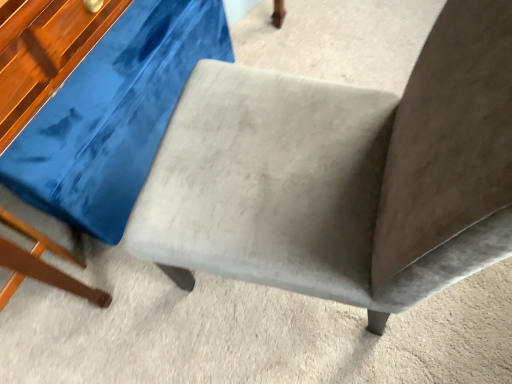
Question: Is suede gray swivel chair at center to the left of suede-like gray chair at center from the viewer's perspective?

Choices:
 (A) yes
 (B) no

Answer: (A)

Question: Is there a large distance between suede gray swivel chair at center and suede-like gray chair at center?

Choices:
 (A) yes
 (B) no

Answer: (B)

Question: From a real-world perspective, is suede gray swivel chair at center below suede-like gray chair at center?

Choices:
 (A) no
 (B) yes

Answer: (B)

Question: Does suede gray swivel chair at center have a larger size compared to suede-like gray chair at center?

Choices:
 (A) yes
 (B) no

Answer: (B)

Question: From the image's perspective, is suede gray swivel chair at center located beneath suede-like gray chair at center?

Choices:
 (A) no
 (B) yes

Answer: (A)

Question: Can you confirm if suede gray swivel chair at center is thinner than suede-like gray chair at center?

Choices:
 (A) yes
 (B) no

Answer: (B)

Question: Would you say suede-like gray chair at center contains suede gray swivel chair at center?

Choices:
 (A) no
 (B) yes

Answer: (A)

Question: From a real-world perspective, is suede-like gray chair at center located beneath suede gray swivel chair at center?

Choices:
 (A) yes
 (B) no

Answer: (B)

Question: Can you see suede-like gray chair at center touching suede gray swivel chair at center?

Choices:
 (A) yes
 (B) no

Answer: (B)

Question: Is suede-like gray chair at center positioned behind suede gray swivel chair at center?

Choices:
 (A) no
 (B) yes

Answer: (A)

Question: Considering the relative positions of suede-like gray chair at center and suede gray swivel chair at center in the image provided, is suede-like gray chair at center to the right of suede gray swivel chair at center from the viewer's perspective?

Choices:
 (A) yes
 (B) no

Answer: (A)

Question: Does suede-like gray chair at center have a lesser width compared to suede gray swivel chair at center?

Choices:
 (A) no
 (B) yes

Answer: (B)

Question: Relative to suede gray swivel chair at center, is suede-like gray chair at center in front or behind?

Choices:
 (A) front
 (B) behind

Answer: (A)